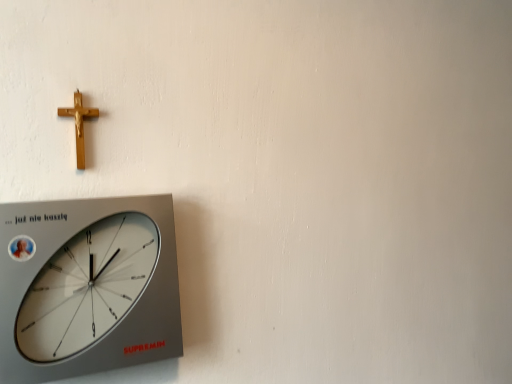
The image size is (512, 384). I want to click on silver metallic wall clock at lower left, so click(x=87, y=287).

The width and height of the screenshot is (512, 384). What do you see at coordinates (87, 287) in the screenshot?
I see `silver metallic wall clock at lower left` at bounding box center [87, 287].

This screenshot has height=384, width=512. Describe the element at coordinates (79, 124) in the screenshot. I see `gold polished crucifix at upper left` at that location.

I want to click on gold polished crucifix at upper left, so click(x=79, y=124).

Measure the distance between gold polished crucifix at upper left and camera.

They are 26.21 inches apart.

Measure the distance between point (x=73, y=108) and camera.

Point (x=73, y=108) is 66.60 centimeters away from camera.

At what (x,y) coordinates should I click in order to perform the action: click on silver metallic wall clock at lower left. Please return your answer as a coordinate pair (x, y). The height and width of the screenshot is (384, 512). Looking at the image, I should click on (87, 287).

Considering the relative positions of gold polished crucifix at upper left and silver metallic wall clock at lower left in the image provided, is gold polished crucifix at upper left to the right of silver metallic wall clock at lower left from the viewer's perspective?

In fact, gold polished crucifix at upper left is to the left of silver metallic wall clock at lower left.

Is the depth of gold polished crucifix at upper left greater than that of silver metallic wall clock at lower left?

Yes, gold polished crucifix at upper left is further from the viewer.

Which point is more distant from viewer, (79, 164) or (71, 362)?

Positioned behind is point (79, 164).

From the image's perspective, is gold polished crucifix at upper left above or below silver metallic wall clock at lower left?

gold polished crucifix at upper left is above silver metallic wall clock at lower left.

From a real-world perspective, which object stands above the other?

A: In real-world perspective, gold polished crucifix at upper left is above.

In terms of width, does gold polished crucifix at upper left look wider or thinner when compared to silver metallic wall clock at lower left?

Clearly, gold polished crucifix at upper left has less width compared to silver metallic wall clock at lower left.

In the scene shown: Does gold polished crucifix at upper left have a lesser height compared to silver metallic wall clock at lower left?

Indeed, gold polished crucifix at upper left has a lesser height compared to silver metallic wall clock at lower left.

Based on their sizes in the image, would you say gold polished crucifix at upper left is bigger or smaller than silver metallic wall clock at lower left?

gold polished crucifix at upper left is smaller than silver metallic wall clock at lower left.

Is gold polished crucifix at upper left located outside silver metallic wall clock at lower left?

That's correct, gold polished crucifix at upper left is outside of silver metallic wall clock at lower left.

Consider the image. Are gold polished crucifix at upper left and silver metallic wall clock at lower left beside each other?

There is a gap between gold polished crucifix at upper left and silver metallic wall clock at lower left.

Is silver metallic wall clock at lower left at the back of gold polished crucifix at upper left?

gold polished crucifix at upper left does not have its back to silver metallic wall clock at lower left.

How many degrees apart are the facing directions of gold polished crucifix at upper left and silver metallic wall clock at lower left?

There is a 1.11-degree angle between the facing directions of gold polished crucifix at upper left and silver metallic wall clock at lower left.

Measure the distance between gold polished crucifix at upper left and silver metallic wall clock at lower left.

19.74 centimeters.

Identify the location of wall clock that appears below the gold polished crucifix at upper left (from a real-world perspective). This screenshot has height=384, width=512. (87, 287).

Is silver metallic wall clock at lower left to the right of gold polished crucifix at upper left from the viewer's perspective?

Yes, silver metallic wall clock at lower left is to the right of gold polished crucifix at upper left.

Looking at this image, is silver metallic wall clock at lower left in front of gold polished crucifix at upper left?

Yes, it is.

Which is nearer, (17, 355) or (86, 114)?

Point (17, 355) appears to be closer to the viewer than point (86, 114).

From the image's perspective, is silver metallic wall clock at lower left located beneath gold polished crucifix at upper left?

Indeed, from the image's perspective, silver metallic wall clock at lower left is shown beneath gold polished crucifix at upper left.

From a real-world perspective, is silver metallic wall clock at lower left physically above gold polished crucifix at upper left?

No, from a real-world perspective, silver metallic wall clock at lower left is not on top of gold polished crucifix at upper left.

Does silver metallic wall clock at lower left have a lesser width compared to gold polished crucifix at upper left?

Incorrect, the width of silver metallic wall clock at lower left is not less than that of gold polished crucifix at upper left.

From their relative heights in the image, would you say silver metallic wall clock at lower left is taller or shorter than gold polished crucifix at upper left?

Considering their sizes, silver metallic wall clock at lower left has more height than gold polished crucifix at upper left.

Can you confirm if silver metallic wall clock at lower left is smaller than gold polished crucifix at upper left?

Actually, silver metallic wall clock at lower left might be larger than gold polished crucifix at upper left.

Is silver metallic wall clock at lower left inside the boundaries of gold polished crucifix at upper left, or outside?

silver metallic wall clock at lower left is spatially situated outside gold polished crucifix at upper left.

Does silver metallic wall clock at lower left touch gold polished crucifix at upper left?

No, silver metallic wall clock at lower left is not beside gold polished crucifix at upper left.

Is gold polished crucifix at upper left at the back of silver metallic wall clock at lower left?

No, silver metallic wall clock at lower left is not facing the opposite direction of gold polished crucifix at upper left.

How many degrees apart are the facing directions of silver metallic wall clock at lower left and gold polished crucifix at upper left?

There is a 1.11-degree angle between the facing directions of silver metallic wall clock at lower left and gold polished crucifix at upper left.

Measure the distance from silver metallic wall clock at lower left to gold polished crucifix at upper left.

silver metallic wall clock at lower left is 7.77 inches away from gold polished crucifix at upper left.

This screenshot has width=512, height=384. I want to click on crucifix above the silver metallic wall clock at lower left (from a real-world perspective), so click(79, 124).

At what (x,y) coordinates should I click in order to perform the action: click on wall clock in front of the gold polished crucifix at upper left. Please return your answer as a coordinate pair (x, y). The image size is (512, 384). Looking at the image, I should click on (87, 287).

Locate an element on the screen. The height and width of the screenshot is (384, 512). crucifix behind the silver metallic wall clock at lower left is located at coordinates (79, 124).